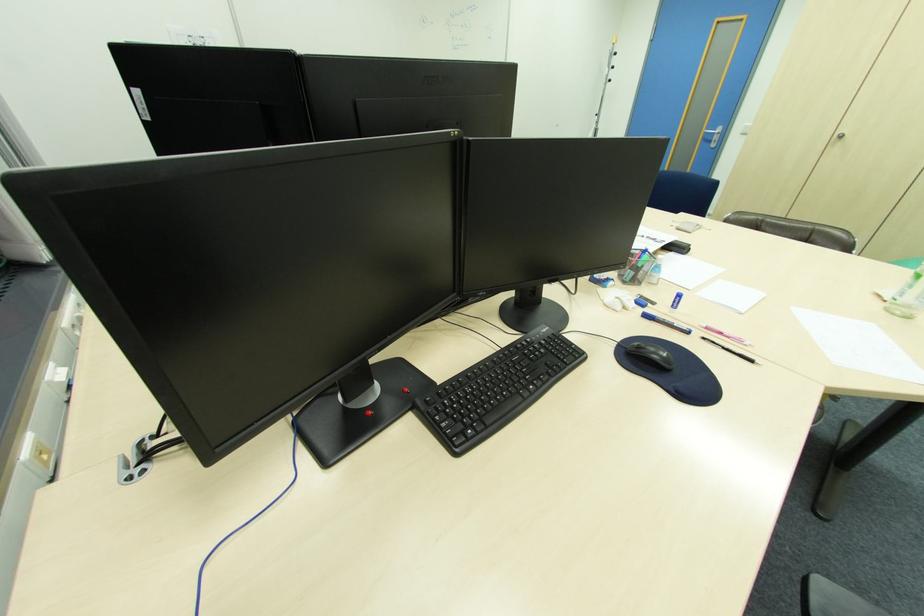
Locate an element on the screen. Image resolution: width=924 pixels, height=616 pixels. black computer mouse is located at coordinates (650, 354).